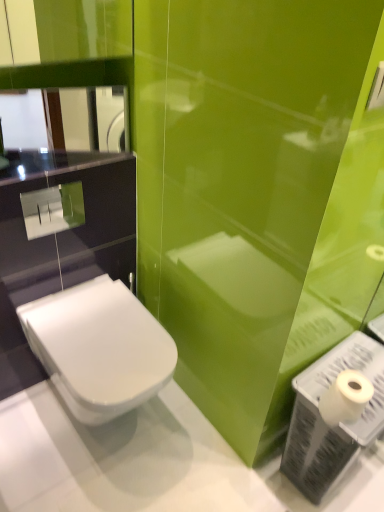
Question: Is white matte toilet paper at lower right far away from glossy glass mirror at upper left?

Choices:
 (A) yes
 (B) no

Answer: (A)

Question: Is white matte toilet paper at lower right oriented towards glossy glass mirror at upper left?

Choices:
 (A) yes
 (B) no

Answer: (B)

Question: Does white matte toilet paper at lower right lie behind glossy glass mirror at upper left?

Choices:
 (A) no
 (B) yes

Answer: (A)

Question: Is white matte toilet paper at lower right to the left of glossy glass mirror at upper left from the viewer's perspective?

Choices:
 (A) yes
 (B) no

Answer: (B)

Question: Is glossy glass mirror at upper left completely or partially inside white matte toilet paper at lower right?

Choices:
 (A) no
 (B) yes

Answer: (A)

Question: Does white matte toilet paper at lower right have a larger size compared to glossy glass mirror at upper left?

Choices:
 (A) no
 (B) yes

Answer: (A)

Question: Is white plastic toilet paper at lower right turned away from glossy glass mirror at upper left?

Choices:
 (A) yes
 (B) no

Answer: (B)

Question: Are white plastic toilet paper at lower right and glossy glass mirror at upper left beside each other?

Choices:
 (A) no
 (B) yes

Answer: (A)

Question: Is white plastic toilet paper at lower right taller than glossy glass mirror at upper left?

Choices:
 (A) no
 (B) yes

Answer: (B)

Question: From a real-world perspective, is white plastic toilet paper at lower right located beneath glossy glass mirror at upper left?

Choices:
 (A) no
 (B) yes

Answer: (B)

Question: From the image's perspective, is white plastic toilet paper at lower right over glossy glass mirror at upper left?

Choices:
 (A) no
 (B) yes

Answer: (A)

Question: Would you say white plastic toilet paper at lower right is outside glossy glass mirror at upper left?

Choices:
 (A) yes
 (B) no

Answer: (A)

Question: Is glossy glass mirror at upper left completely or partially inside white glossy toilet at lower left?

Choices:
 (A) yes
 (B) no

Answer: (B)